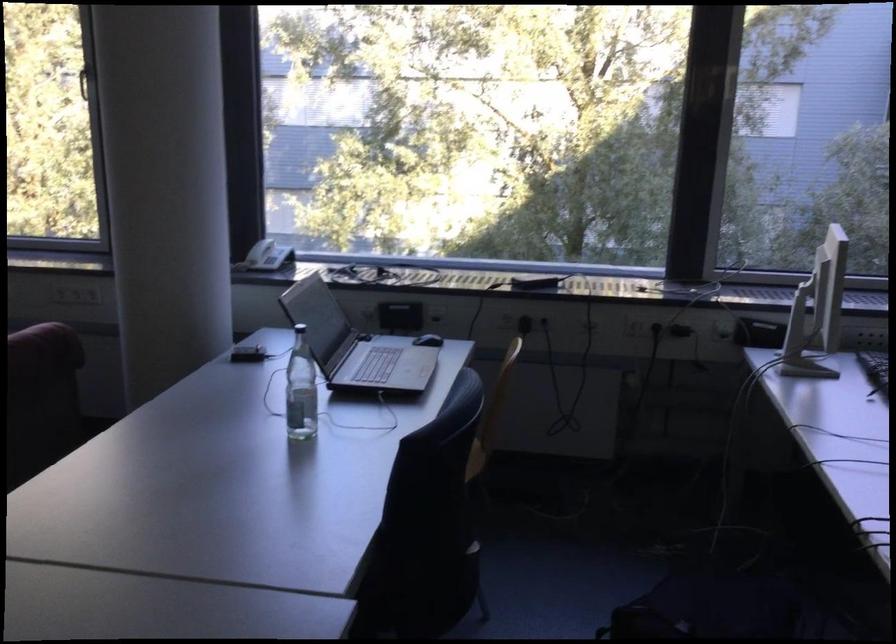
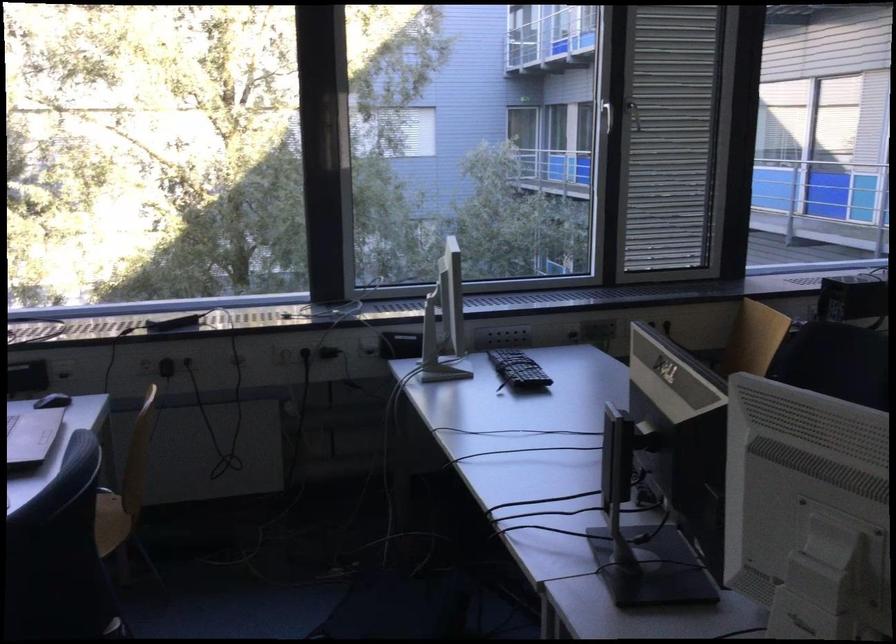
In the second image, find the point that corresponds to pixel 504 317 in the first image.

(144, 365)